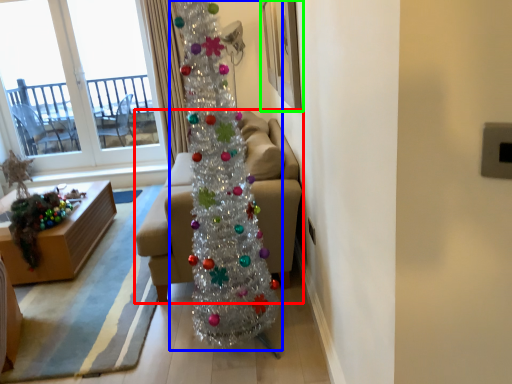
Question: Based on their relative distances, which object is nearer to studio couch (highlighted by a red box)? Choose from christmas tree (highlighted by a blue box) and picture frame (highlighted by a green box).

Choices:
 (A) christmas tree
 (B) picture frame

Answer: (A)